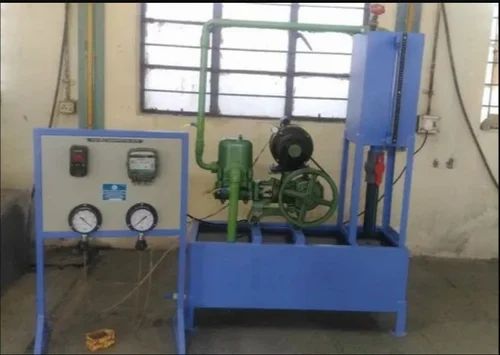
The height and width of the screenshot is (355, 500). Find the location of `switch`. switch is located at coordinates (70, 108), (80, 163).